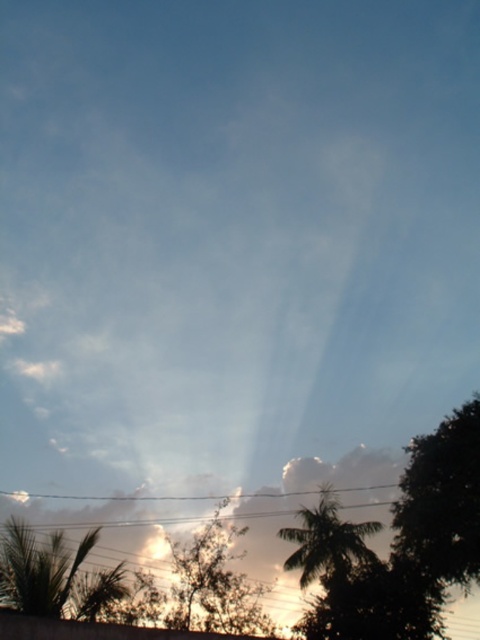
Is the position of green leafy tree at center more distant than that of silhouette leafy palm at lower right?

No, green leafy tree at center is in front of silhouette leafy palm at lower right.

Is green leafy tree at center below silhouette leafy palm at lower right?

Correct, green leafy tree at center is located below silhouette leafy palm at lower right.

Is point (251, 586) positioned before point (328, 529)?

Yes, it is.

Locate an element on the screen. This screenshot has width=480, height=640. green leafy tree at center is located at coordinates (213, 582).

Which is in front, point (465, 493) or point (240, 620)?

Point (465, 493) is more forward.

Is green leafy tree at right positioned in front of green leafy tree at center?

That is True.

The image size is (480, 640). What do you see at coordinates (443, 499) in the screenshot? I see `green leafy tree at right` at bounding box center [443, 499].

The height and width of the screenshot is (640, 480). I want to click on green leafy tree at right, so click(x=443, y=499).

Is green leafy tree at right bigger than silhouette leafy palm at lower right?

Yes, green leafy tree at right is bigger than silhouette leafy palm at lower right.

Who is more distant from viewer, (455, 541) or (333, 561)?

The point (333, 561) is behind.

At what (x,y) coordinates should I click in order to perform the action: click on green leafy tree at right. Please return your answer as a coordinate pair (x, y). Looking at the image, I should click on (443, 499).